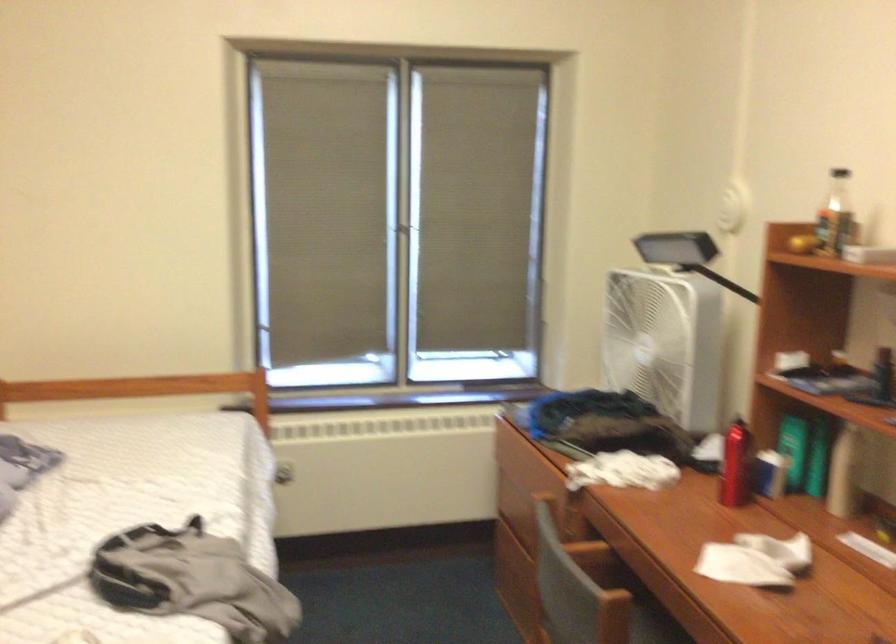
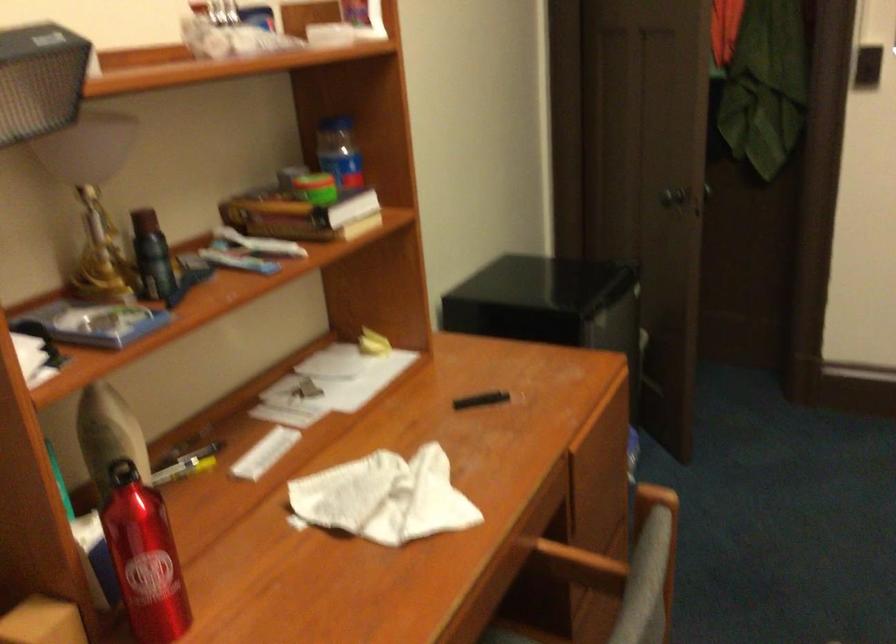
Locate, in the second image, the point that corresponds to the point at 745,544 in the first image.

(383, 498)